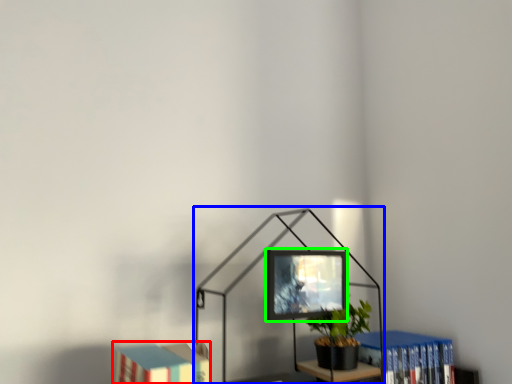
Question: Which object is the farthest from book (highlighted by a red box)? Choose among these: table lamp (highlighted by a blue box) or computer monitor (highlighted by a green box).

Choices:
 (A) table lamp
 (B) computer monitor

Answer: (B)